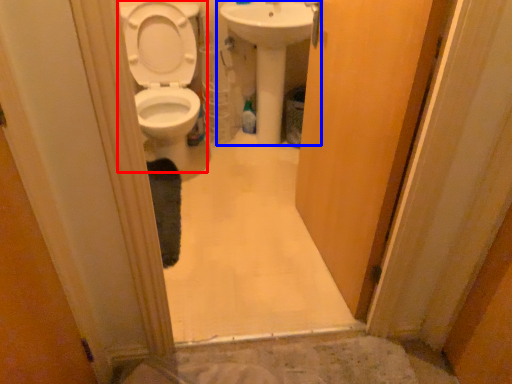
Question: Among these objects, which one is farthest to the camera, toilet (highlighted by a red box) or sink (highlighted by a blue box)?

Choices:
 (A) toilet
 (B) sink

Answer: (B)